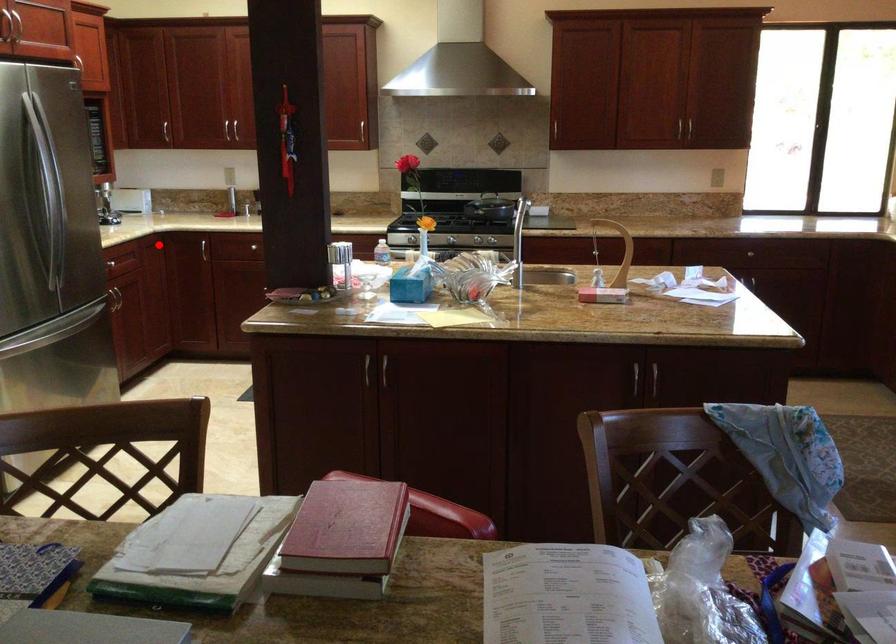
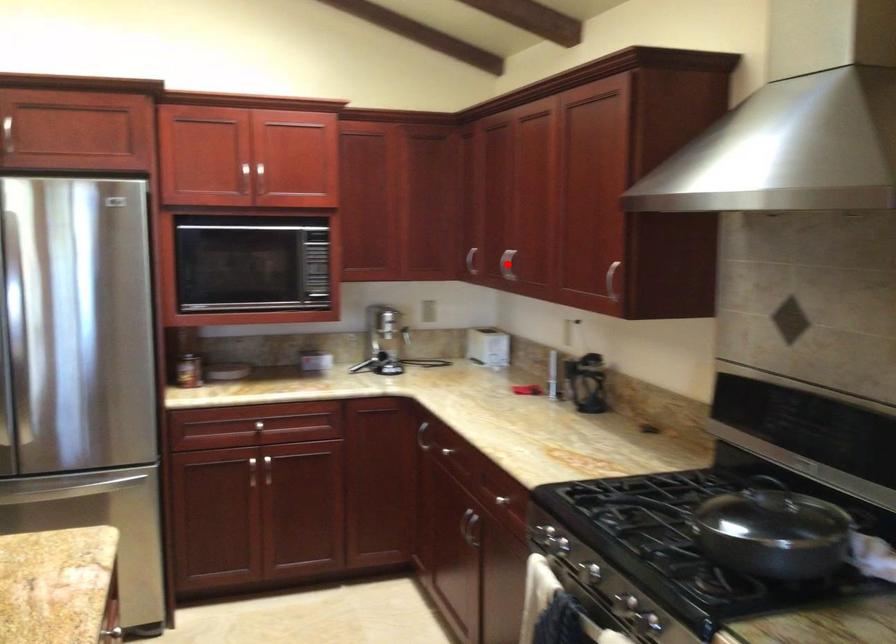
I am providing you with two images of the same scene from different viewpoints. A red point is marked on the first image and another point is marked on the second image. Do the highlighted points in image1 and image2 indicate the same real-world spot?

No